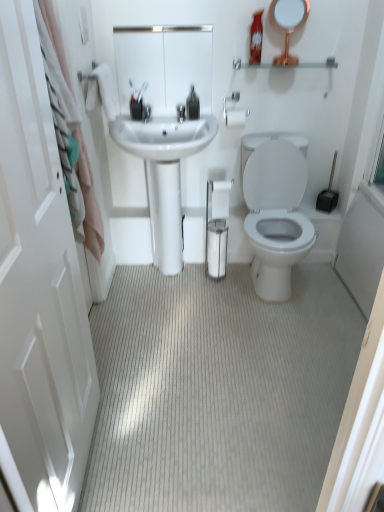
Question: From a real-world perspective, is white glossy sink at center physically located above or below white glossy mirror at upper center, placed as the first mirror when sorted from left to right?

Choices:
 (A) below
 (B) above

Answer: (A)

Question: Does point (117, 118) appear closer or farther from the camera than point (195, 28)?

Choices:
 (A) closer
 (B) farther

Answer: (B)

Question: Which of these objects is positioned closest to the white fabric shower curtain at left?

Choices:
 (A) white glossy mirror at upper center, which is the second mirror from right to left
 (B) silver metallic towel bar at upper center
 (C) clear glass shelf at upper center
 (D) neutral carpet at center
 (E) white glossy screen door at left

Answer: (A)

Question: Which is farther from the silver metallic towel bar at upper center?

Choices:
 (A) white glossy sink at center
 (B) white glossy screen door at left
 (C) white fabric shower curtain at left
 (D) clear glass shelf at upper center
 (E) white glossy mirror at upper center, placed as the first mirror when sorted from left to right

Answer: (B)